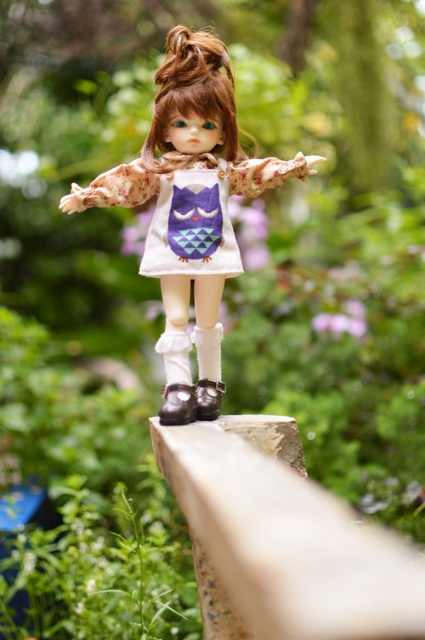
You are a photographer setting up a shoot with the doll. You need to adjust the lighting so that the white matte dress at center is illuminated while keeping the shiny brown shoe at lower center in shadow. Is this possible based on their positions?

Yes, since the white matte dress at center is closer to the viewer than the shiny brown shoe at lower center, you can position the light source in a way that illuminates the dress directly while the shoe remains in shadow due to its farther position.